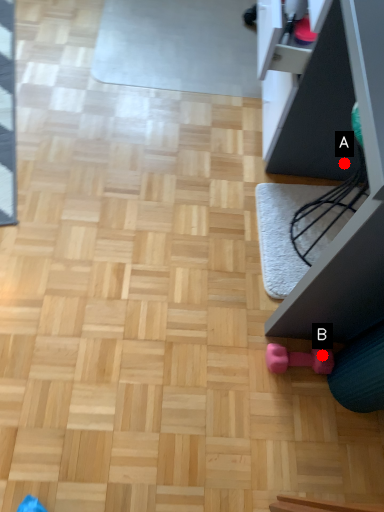
Question: Two points are circled on the image, labeled by A and B beside each circle. Which point appears farthest from the camera in this image?

Choices:
 (A) A is further
 (B) B is further

Answer: (A)